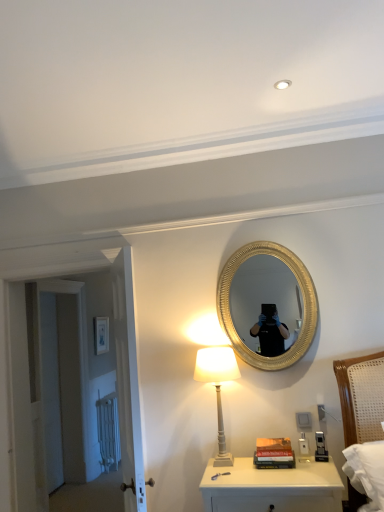
Question: Can you confirm if white glossy nightstand at lower center is positioned to the left of white painted wood table lamp at lower center?

Choices:
 (A) no
 (B) yes

Answer: (A)

Question: Can you confirm if white glossy nightstand at lower center is wider than white painted wood table lamp at lower center?

Choices:
 (A) no
 (B) yes

Answer: (B)

Question: Does white glossy nightstand at lower center turn towards white painted wood table lamp at lower center?

Choices:
 (A) no
 (B) yes

Answer: (A)

Question: Is white glossy nightstand at lower center further to the viewer compared to white painted wood table lamp at lower center?

Choices:
 (A) no
 (B) yes

Answer: (A)

Question: Would you say white glossy nightstand at lower center is a long distance from white painted wood table lamp at lower center?

Choices:
 (A) no
 (B) yes

Answer: (A)

Question: Is white wooden door at left, which is counted as the 1th door, starting from the front, situated inside hardcover books at center or outside?

Choices:
 (A) outside
 (B) inside

Answer: (A)

Question: Is white wooden door at left, which appears as the 2th door when viewed from the back, bigger or smaller than hardcover books at center?

Choices:
 (A) big
 (B) small

Answer: (A)

Question: From the image's perspective, relative to hardcover books at center, is white wooden door at left, which appears as the 2th door when viewed from the back, above or below?

Choices:
 (A) below
 (B) above

Answer: (B)

Question: Does point (31, 456) appear closer or farther from the camera than point (253, 463)?

Choices:
 (A) farther
 (B) closer

Answer: (A)

Question: Is matte white picture frame at upper left in front of or behind hardcover books at center in the image?

Choices:
 (A) front
 (B) behind

Answer: (B)

Question: Is matte white picture frame at upper left bigger or smaller than hardcover books at center?

Choices:
 (A) small
 (B) big

Answer: (B)

Question: In the image, is matte white picture frame at upper left on the left side or the right side of hardcover books at center?

Choices:
 (A) right
 (B) left

Answer: (B)

Question: Is point (102, 320) closer or farther from the camera than point (258, 456)?

Choices:
 (A) closer
 (B) farther

Answer: (B)

Question: Is point (87, 376) closer or farther from the camera than point (316, 501)?

Choices:
 (A) farther
 (B) closer

Answer: (A)

Question: Looking at their shapes, would you say white wooden door at left, which appears as the 2th door when viewed from the back, is wider or thinner than white glossy nightstand at lower center?

Choices:
 (A) thin
 (B) wide

Answer: (A)